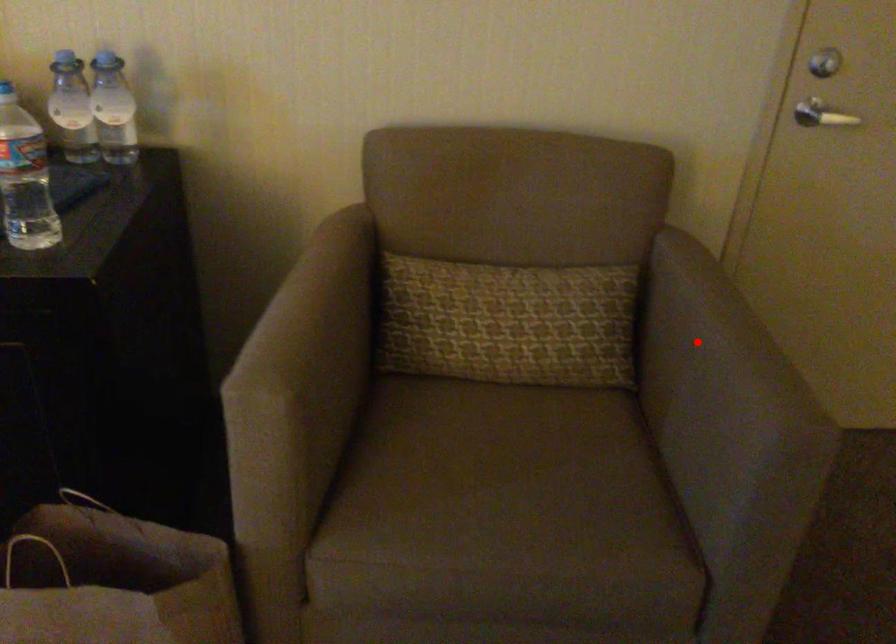
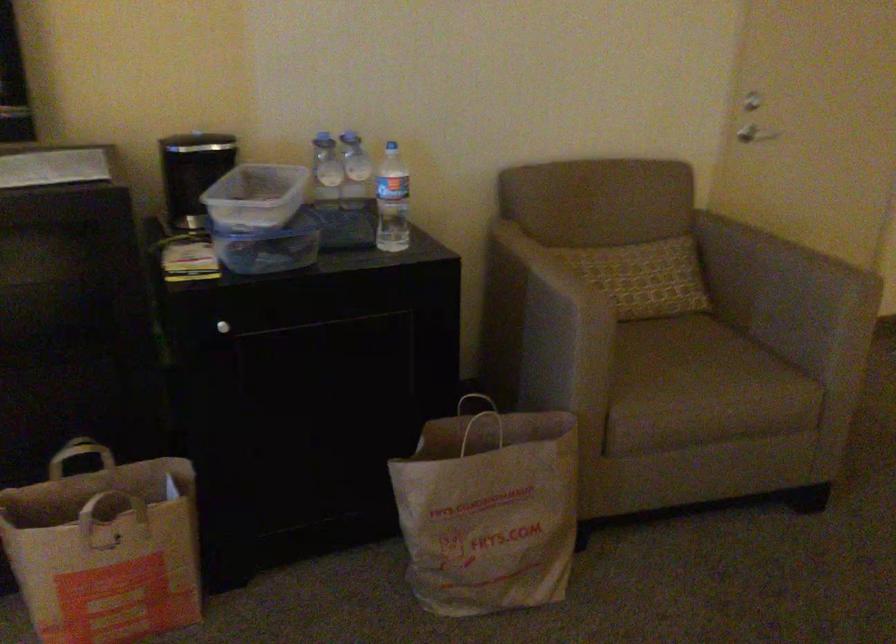
Question: I am providing you with two images of the same scene from different viewpoints. In image1, a red point is highlighted. Considering the same 3D point in image2, which of the following is correct?

Choices:
 (A) It is closer
 (B) It is farther

Answer: (B)